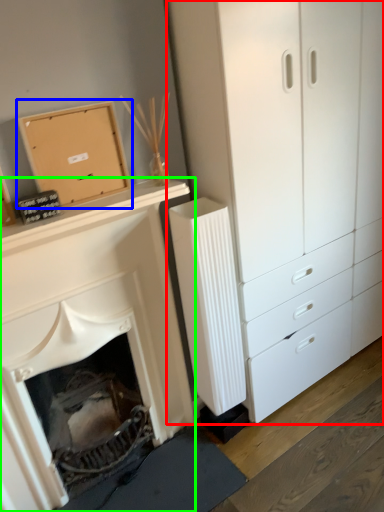
Question: Which object is the farthest from chest of drawers (highlighted by a red box)? Choose among these: cardboard box (highlighted by a blue box) or fireplace (highlighted by a green box).

Choices:
 (A) cardboard box
 (B) fireplace

Answer: (A)